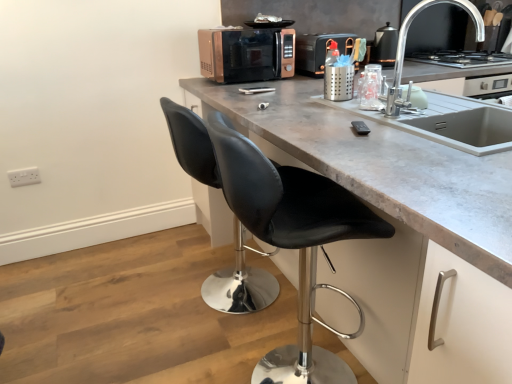
Question: Does concrete gray countertop at center have a greater height compared to rose gold metallic microwave at center?

Choices:
 (A) no
 (B) yes

Answer: (B)

Question: Is concrete gray countertop at center bigger than rose gold metallic microwave at center?

Choices:
 (A) yes
 (B) no

Answer: (A)

Question: Is concrete gray countertop at center facing towards rose gold metallic microwave at center?

Choices:
 (A) yes
 (B) no

Answer: (B)

Question: Is concrete gray countertop at center further to the viewer compared to rose gold metallic microwave at center?

Choices:
 (A) no
 (B) yes

Answer: (A)

Question: From a real-world perspective, is concrete gray countertop at center over rose gold metallic microwave at center?

Choices:
 (A) no
 (B) yes

Answer: (A)

Question: Is concrete gray countertop at center beside rose gold metallic microwave at center?

Choices:
 (A) yes
 (B) no

Answer: (B)

Question: Is rose gold metallic toaster at upper center, the second appliance in the right-to-left sequence, further to camera compared to metallic silver kettle at upper right, the second appliance from the left?

Choices:
 (A) no
 (B) yes

Answer: (A)

Question: From the image's perspective, would you say rose gold metallic toaster at upper center, the 1th appliance viewed from the left, is positioned over metallic silver kettle at upper right, which is the 1th appliance in right-to-left order?

Choices:
 (A) no
 (B) yes

Answer: (A)

Question: Is rose gold metallic toaster at upper center, the 1th appliance viewed from the left, at the right side of metallic silver kettle at upper right, which is the 1th appliance in right-to-left order?

Choices:
 (A) no
 (B) yes

Answer: (A)

Question: Is metallic silver kettle at upper right, which is the 1th appliance in right-to-left order, inside rose gold metallic toaster at upper center, the 1th appliance viewed from the left?

Choices:
 (A) no
 (B) yes

Answer: (A)

Question: Would you consider rose gold metallic toaster at upper center, the second appliance in the right-to-left sequence, to be distant from metallic silver kettle at upper right, which is the 1th appliance in right-to-left order?

Choices:
 (A) no
 (B) yes

Answer: (A)

Question: Is rose gold metallic toaster at upper center, the 1th appliance viewed from the left, smaller than metallic silver kettle at upper right, the second appliance from the left?

Choices:
 (A) no
 (B) yes

Answer: (A)

Question: Can you confirm if rose gold metallic microwave at center is shorter than concrete gray countertop at center?

Choices:
 (A) yes
 (B) no

Answer: (A)